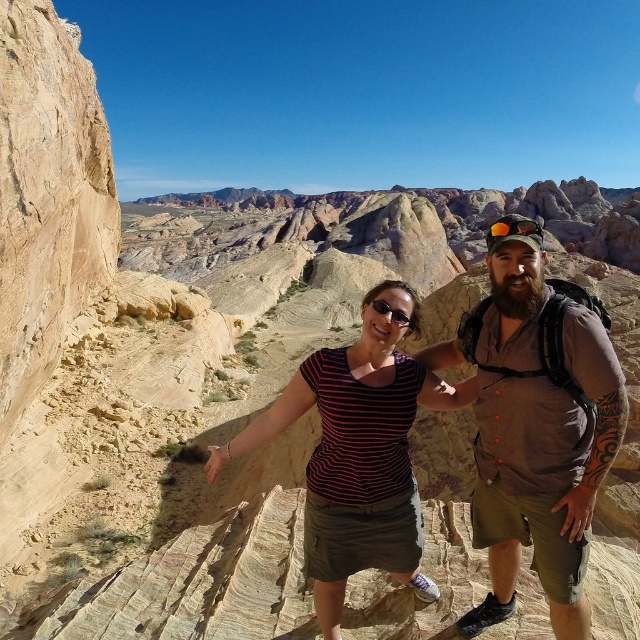
You are a photographer trying to capture a photo of both the brown cotton shirt at center and the striped fabric shirt at center in the same frame. Based on their positions, which shirt should you focus on first to ensure both are in the frame?

The striped fabric shirt at center is to the left of the brown cotton shirt at center, so focusing on the striped fabric shirt at center first will allow you to include both shirts in the frame.

You are a photographer trying to capture the brown cotton shirt at center in your shot. Based on the coordinates provided, where should you position your camera to ensure the shirt is centered in the frame?

The brown cotton shirt at center is located at coordinates point (536, 429), so positioning the camera to aim directly at those coordinates will center the shirt in the frame.